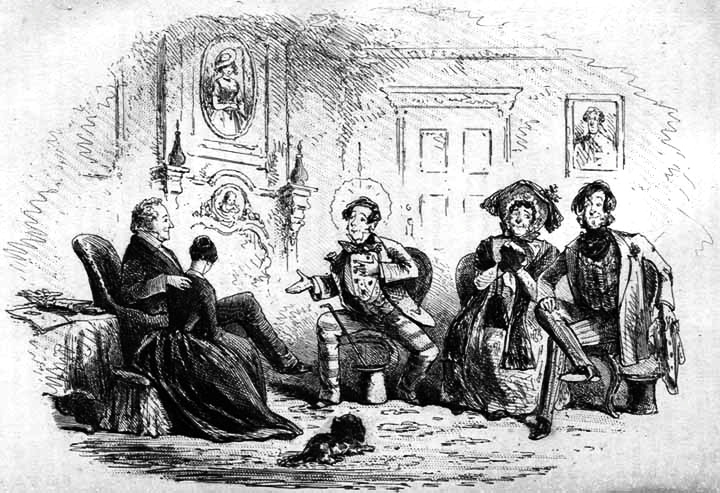
This screenshot has width=720, height=493. Identify the location of round picture on wall. (222, 44), (229, 74), (228, 109), (211, 84), (243, 85).